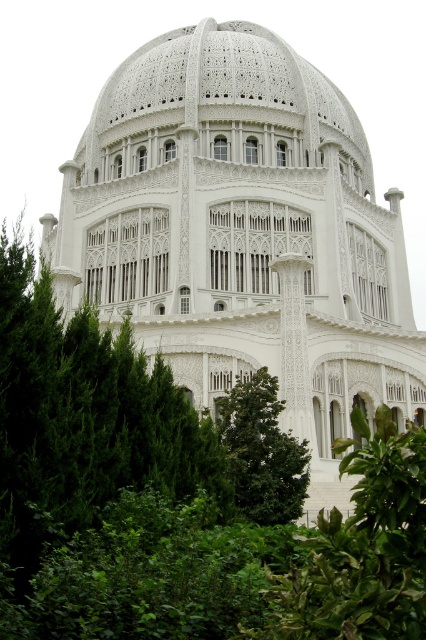
Does white stone dome at center have a lesser width compared to white carved dome at center?

No, white stone dome at center is not thinner than white carved dome at center.

Where is `white stone dome at center`? The height and width of the screenshot is (640, 426). white stone dome at center is located at coordinates (242, 234).

Which is below, white carved dome at center or green leafy tree at center?

green leafy tree at center is lower down.

The image size is (426, 640). Find the location of `white carved dome at center`. white carved dome at center is located at coordinates (224, 97).

Which of these two, white stone dome at center or green leafy tree at center, stands shorter?

green leafy tree at center is shorter.

Is white stone dome at center behind green leafy tree at center?

That is True.

Who is more forward, [169,227] or [230,477]?

Point [230,477] is more forward.

At what (x,y) coordinates should I click in order to perform the action: click on white stone dome at center. Please return your answer as a coordinate pair (x, y). The height and width of the screenshot is (640, 426). Looking at the image, I should click on (242, 234).